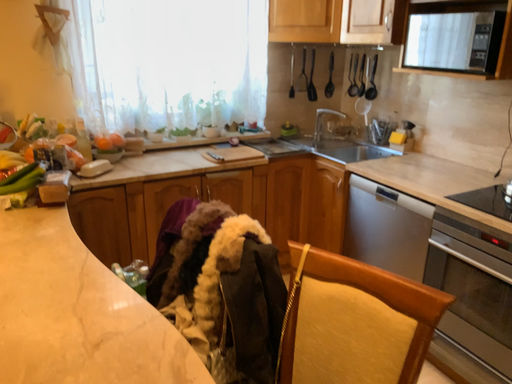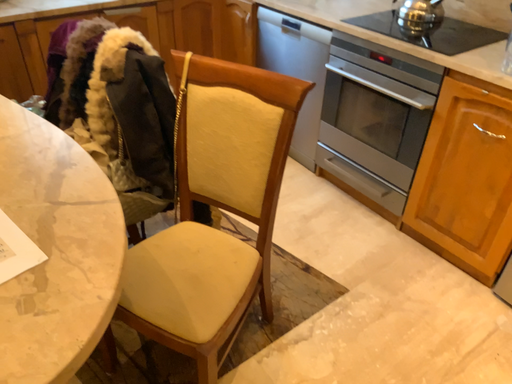
Question: How did the camera likely rotate when shooting the video?

Choices:
 (A) rotated left
 (B) rotated right

Answer: (B)